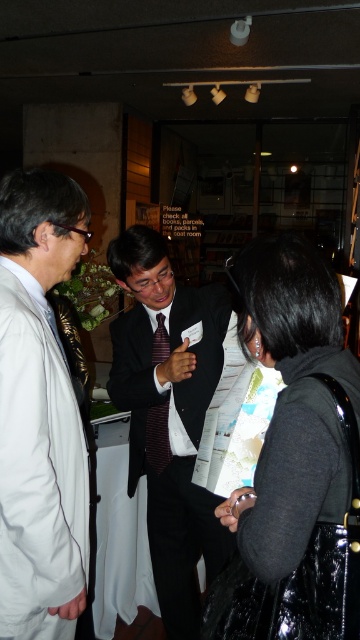
Which is above, white matte coat at left or matte black suit at center?

white matte coat at left is higher up.

Which is in front, point (25, 584) or point (163, 346)?

Point (25, 584) is more forward.

Identify the location of white matte coat at left. (38, 468).

Who is higher up, black shiny jacket at lower right or striped silk tie at center?

Positioned higher is black shiny jacket at lower right.

This screenshot has height=640, width=360. I want to click on black shiny jacket at lower right, so click(x=294, y=460).

What do you see at coordinates (294, 460) in the screenshot? I see `black shiny jacket at lower right` at bounding box center [294, 460].

Image resolution: width=360 pixels, height=640 pixels. Find the location of `black shiny jacket at lower right`. black shiny jacket at lower right is located at coordinates (294, 460).

Is matte black suit at center further to camera compared to striped silk tie at center?

No, matte black suit at center is in front of striped silk tie at center.

Image resolution: width=360 pixels, height=640 pixels. What do you see at coordinates (168, 413) in the screenshot? I see `matte black suit at center` at bounding box center [168, 413].

The width and height of the screenshot is (360, 640). Identify the location of matte black suit at center. (168, 413).